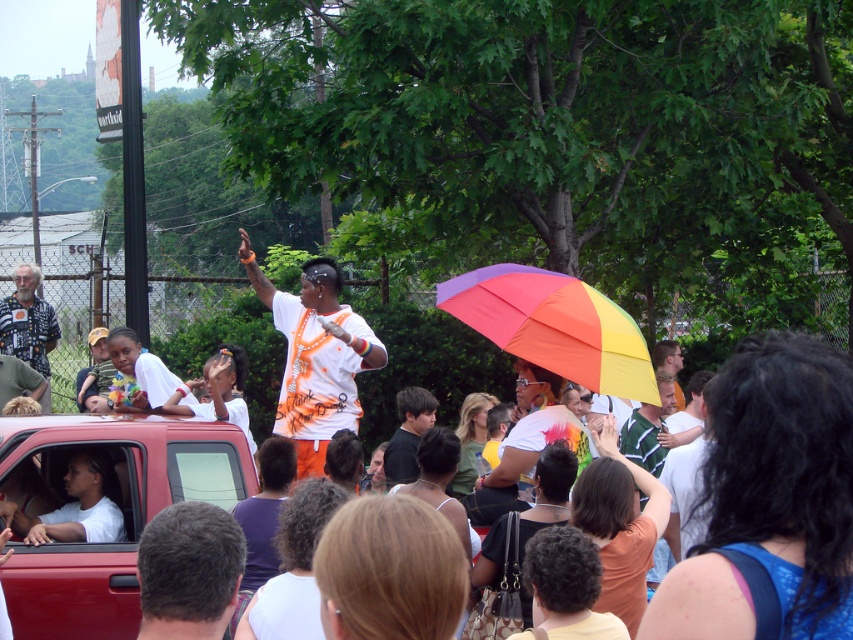
Which is above, rainbow fabric umbrella at center or printed fabric shirt at left?

printed fabric shirt at left is above.

Does rainbow fabric umbrella at center appear under printed fabric shirt at left?

Yes, rainbow fabric umbrella at center is below printed fabric shirt at left.

Who is more distant from viewer, (641,358) or (33,285)?

The point (33,285) is behind.

Where is `rainbow fabric umbrella at center`? rainbow fabric umbrella at center is located at coordinates (554, 324).

Who is positioned more to the right, matte red truck at lower left or black matte shirt at center?

Positioned to the right is black matte shirt at center.

Does matte red truck at lower left have a smaller size compared to black matte shirt at center?

Incorrect, matte red truck at lower left is not smaller in size than black matte shirt at center.

Does point (103, 440) come closer to viewer compared to point (424, 390)?

Yes, point (103, 440) is in front of point (424, 390).

I want to click on matte red truck at lower left, so click(x=119, y=506).

Does dark brown hair at lower left have a lesser width compared to black matte shirt at center?

Yes, dark brown hair at lower left is thinner than black matte shirt at center.

Can you confirm if dark brown hair at lower left is positioned to the left of black matte shirt at center?

Yes, dark brown hair at lower left is to the left of black matte shirt at center.

Who is more distant from viewer, (154, 616) or (415, 440)?

Positioned behind is point (415, 440).

Where is `dark brown hair at lower left`? Image resolution: width=853 pixels, height=640 pixels. dark brown hair at lower left is located at coordinates (189, 572).